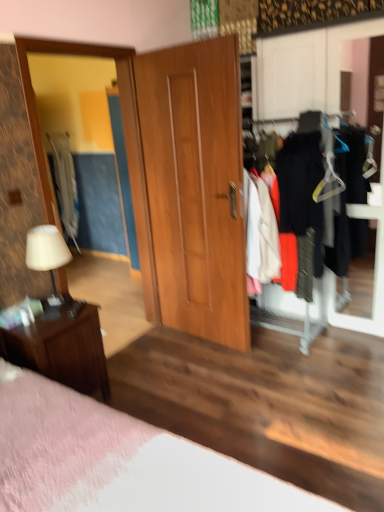
Locate an element on the screen. The height and width of the screenshot is (512, 384). free space in front of wooden door at center is located at coordinates (196, 380).